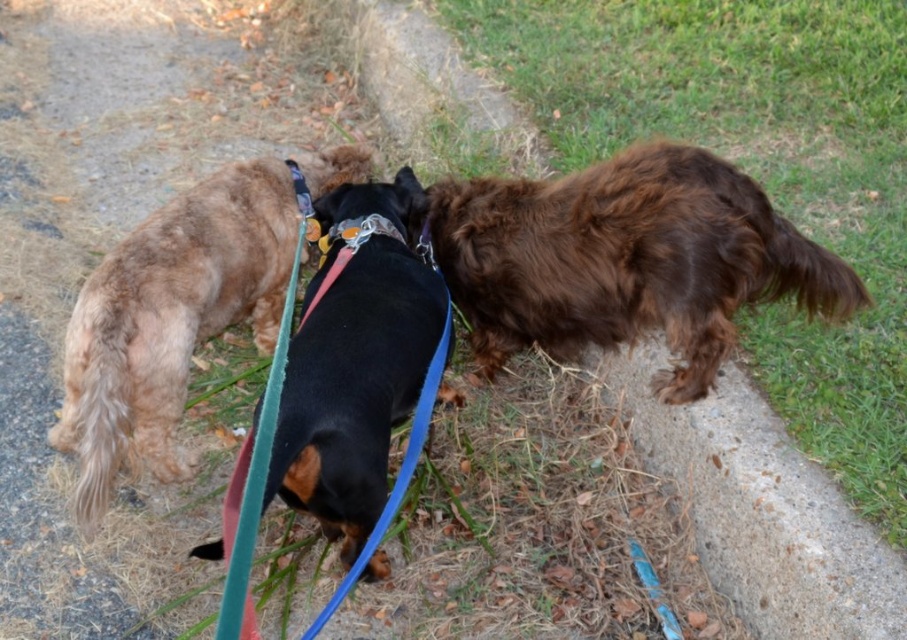
You are a dog owner who wants to ensure your metallic silver neckband at center is visible to other walkers. Considering the shaggy brown dog at right, which is taller, could the neckband be easily seen when attached to the dog?

The metallic silver neckband at center would be less visible when attached to the shaggy brown dog at right because the dog is taller than the neckband, potentially obscuring it from lower viewpoints.